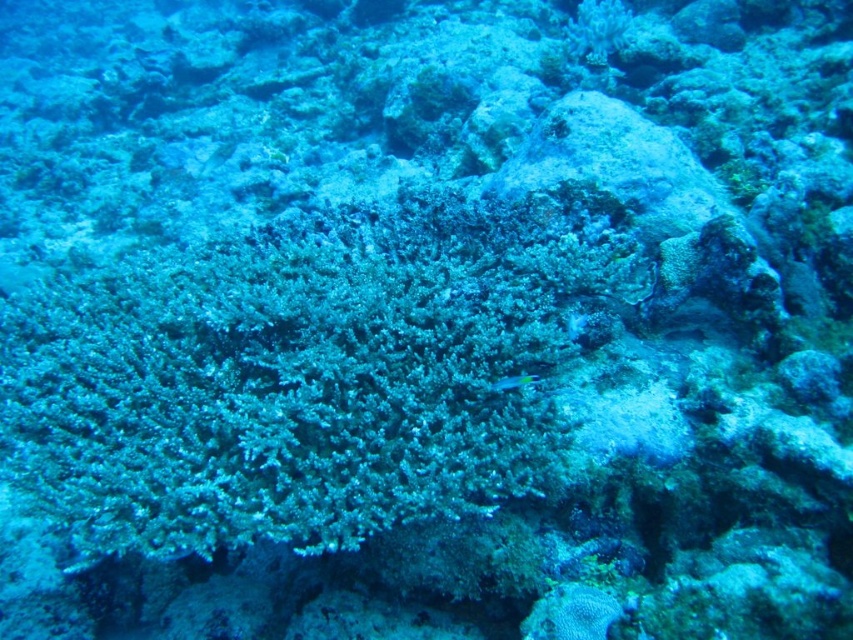
Can you confirm if green matte coral at center is thinner than shiny blue fish at center?

No, green matte coral at center is not thinner than shiny blue fish at center.

Does green matte coral at center have a greater width compared to shiny blue fish at center?

Yes.

Describe the element at coordinates (303, 374) in the screenshot. I see `green matte coral at center` at that location.

The height and width of the screenshot is (640, 853). What are the coordinates of `green matte coral at center` in the screenshot? It's located at (303, 374).